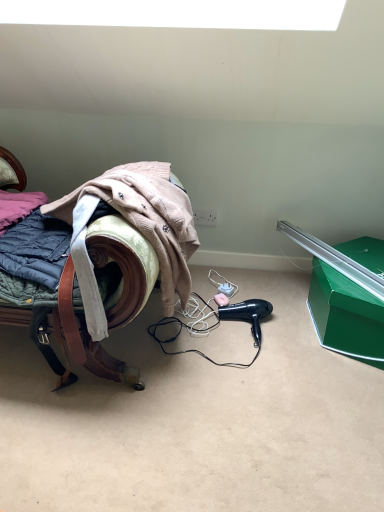
Question: Do you think green cardboard box at lower right is within velvet green suitcase at left, or outside of it?

Choices:
 (A) inside
 (B) outside

Answer: (B)

Question: Is green cardboard box at lower right to the left or to the right of velvet green suitcase at left in the image?

Choices:
 (A) left
 (B) right

Answer: (B)

Question: Based on their relative distances, which object is farther from the velvet green suitcase at left?

Choices:
 (A) black plastic hair dryer at lower center
 (B) green cardboard box at lower right

Answer: (B)

Question: Based on their relative distances, which object is nearer to the black plastic hair dryer at lower center?

Choices:
 (A) velvet green suitcase at left
 (B) green cardboard box at lower right

Answer: (B)